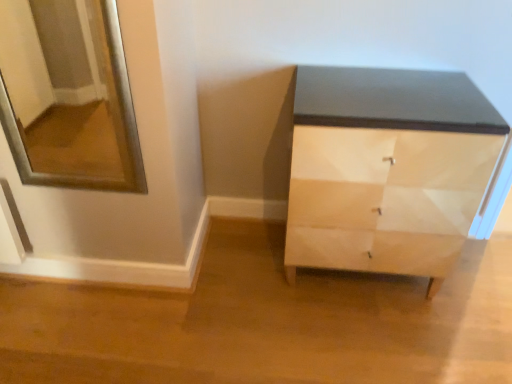
Question: From a real-world perspective, is white glossy drawer at lower right beneath matte black cabinet at center?

Choices:
 (A) no
 (B) yes

Answer: (B)

Question: Is white glossy drawer at lower right positioned in front of matte black cabinet at center?

Choices:
 (A) yes
 (B) no

Answer: (B)

Question: Does white glossy drawer at lower right have a larger size compared to matte black cabinet at center?

Choices:
 (A) yes
 (B) no

Answer: (B)

Question: Can you confirm if white glossy drawer at lower right is wider than matte black cabinet at center?

Choices:
 (A) no
 (B) yes

Answer: (A)

Question: From the image's perspective, is white glossy drawer at lower right located above matte black cabinet at center?

Choices:
 (A) no
 (B) yes

Answer: (A)

Question: From the image's perspective, is silver/metallic mirror at upper left above or below white glossy drawer at lower right?

Choices:
 (A) above
 (B) below

Answer: (A)

Question: Looking at their shapes, would you say silver/metallic mirror at upper left is wider or thinner than white glossy drawer at lower right?

Choices:
 (A) thin
 (B) wide

Answer: (B)

Question: In the image, is silver/metallic mirror at upper left positioned in front of or behind white glossy drawer at lower right?

Choices:
 (A) behind
 (B) front

Answer: (B)

Question: Based on their sizes in the image, would you say silver/metallic mirror at upper left is bigger or smaller than white glossy drawer at lower right?

Choices:
 (A) small
 (B) big

Answer: (B)

Question: In terms of height, does matte black cabinet at center look taller or shorter compared to silver/metallic mirror at upper left?

Choices:
 (A) tall
 (B) short

Answer: (A)

Question: Looking at their shapes, would you say matte black cabinet at center is wider or thinner than silver/metallic mirror at upper left?

Choices:
 (A) thin
 (B) wide

Answer: (B)

Question: Based on their sizes in the image, would you say matte black cabinet at center is bigger or smaller than silver/metallic mirror at upper left?

Choices:
 (A) small
 (B) big

Answer: (B)

Question: From a real-world perspective, relative to silver/metallic mirror at upper left, is matte black cabinet at center vertically above or below?

Choices:
 (A) above
 (B) below

Answer: (B)

Question: Relative to matte black cabinet at center, is white glossy drawer at lower right in front or behind?

Choices:
 (A) behind
 (B) front

Answer: (A)

Question: Do you think white glossy drawer at lower right is within matte black cabinet at center, or outside of it?

Choices:
 (A) inside
 (B) outside

Answer: (A)